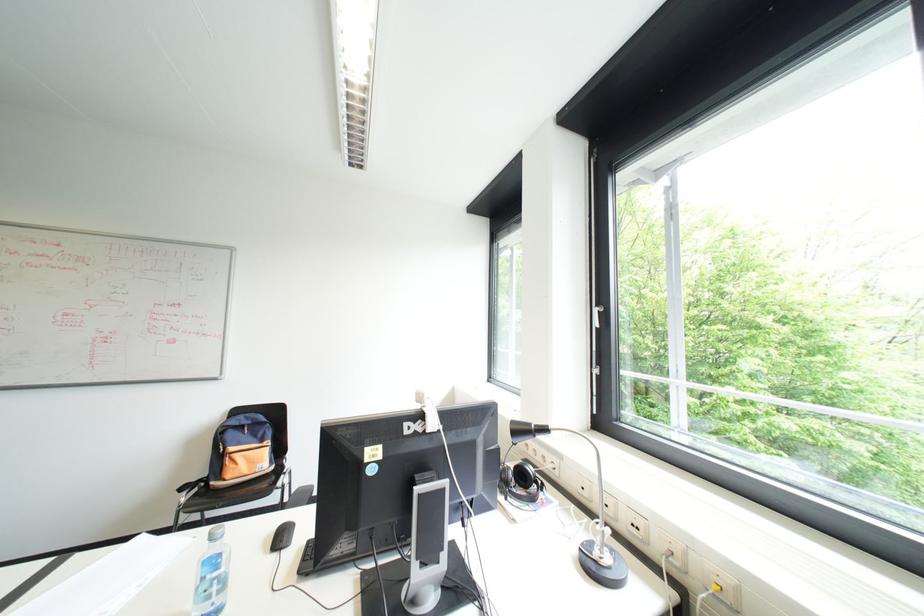
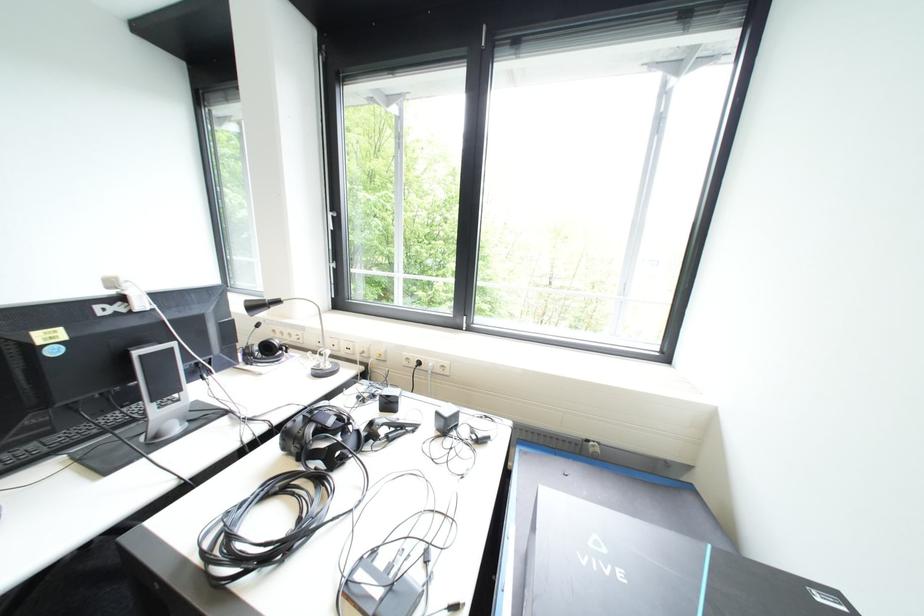
Locate, in the second image, the point that corresponds to point (435, 430) in the first image.

(148, 309)